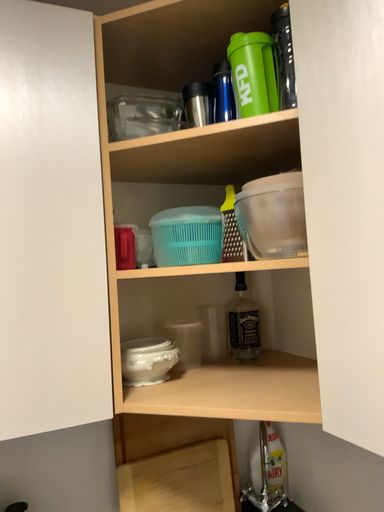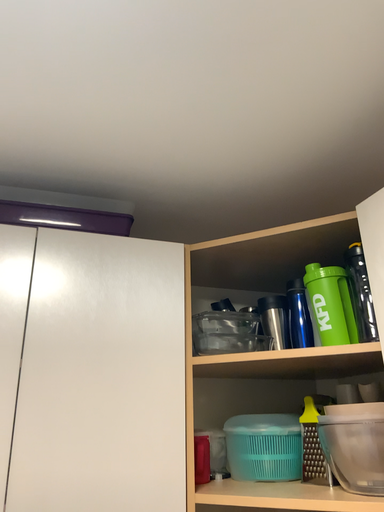
Question: Which way did the camera rotate in the video?

Choices:
 (A) rotated left
 (B) rotated right

Answer: (A)